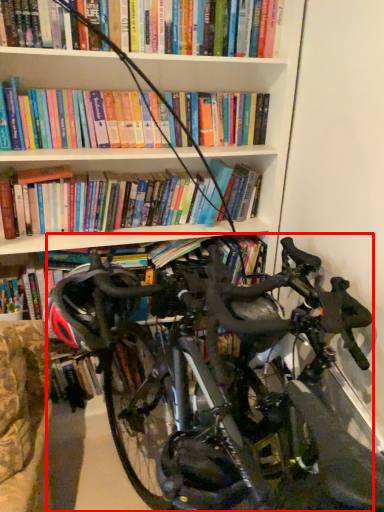
Question: From the image's perspective, where is bicycle (annotated by the red box) located in relation to helmet in the image?

Choices:
 (A) below
 (B) above

Answer: (A)